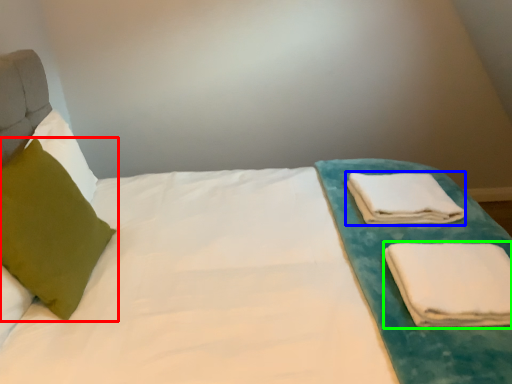
Question: Which object is the farthest from pillow (highlighted by a red box)? Choose among these: cloth (highlighted by a blue box) or cloth (highlighted by a green box).

Choices:
 (A) cloth
 (B) cloth

Answer: (A)